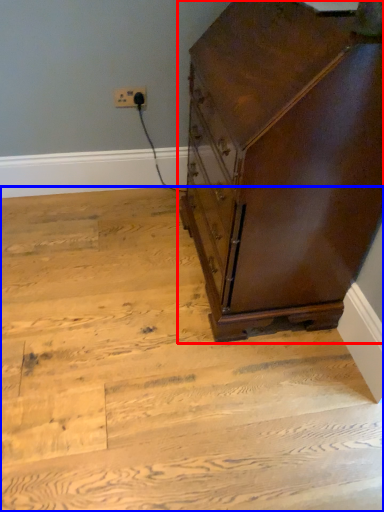
Question: Which object is closer to the camera taking this photo, chest of drawers (highlighted by a red box) or stairwell (highlighted by a blue box)?

Choices:
 (A) chest of drawers
 (B) stairwell

Answer: (A)